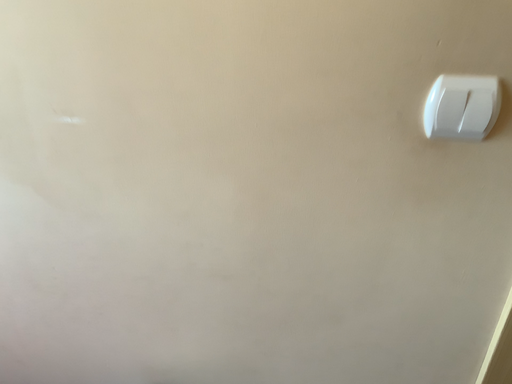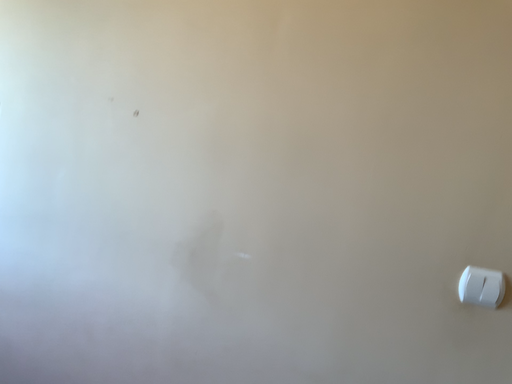
Question: Which way did the camera rotate in the video?

Choices:
 (A) rotated downward
 (B) rotated upward

Answer: (B)